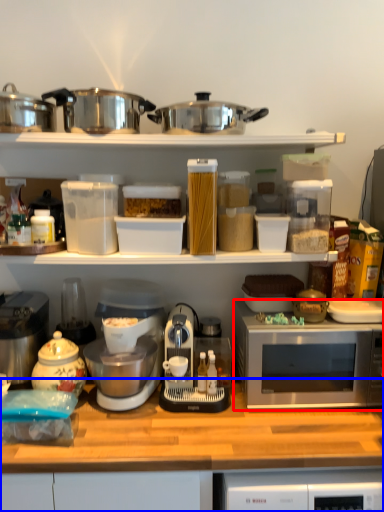
Question: Which of the following is the farthest to the observer, microwave oven (highlighted by a red box) or countertop (highlighted by a blue box)?

Choices:
 (A) microwave oven
 (B) countertop

Answer: (A)